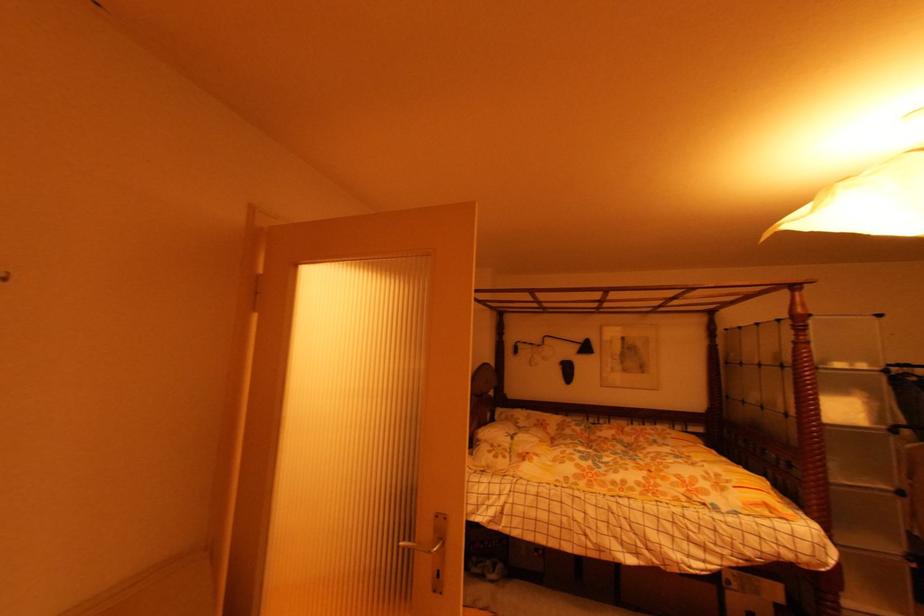
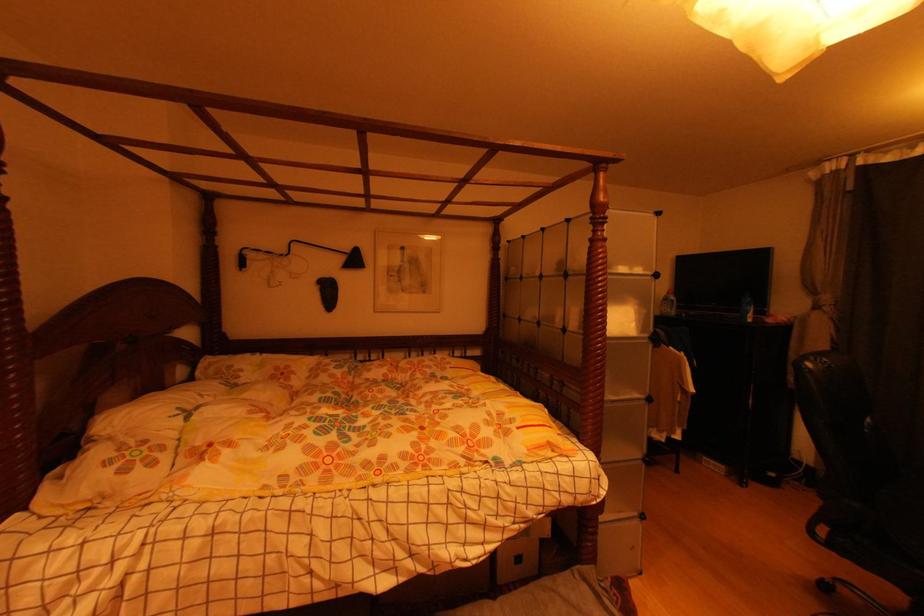
Find the pixel in the second image that matches (x=580, y=347) in the first image.

(346, 261)